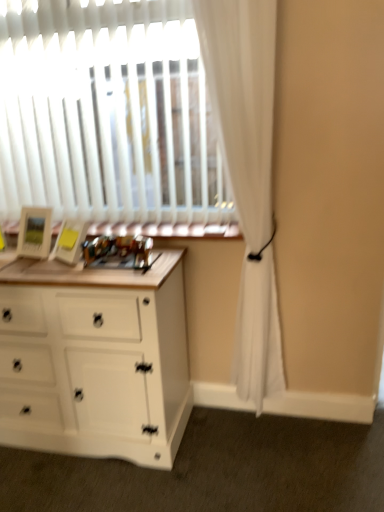
Question: Visually, is wooden frame at center positioned to the left or to the right of white matte chest of drawers at left?

Choices:
 (A) left
 (B) right

Answer: (B)

Question: In the image, is wooden frame at center positioned in front of or behind white matte chest of drawers at left?

Choices:
 (A) front
 (B) behind

Answer: (B)

Question: Which object is the closest to the wooden frame at center?

Choices:
 (A) white sheer curtain at right
 (B) white matte chest of drawers at left

Answer: (A)

Question: Estimate the real-world distances between objects in this image. Which object is closer to the wooden frame at center?

Choices:
 (A) white matte chest of drawers at left
 (B) white sheer curtain at right

Answer: (B)